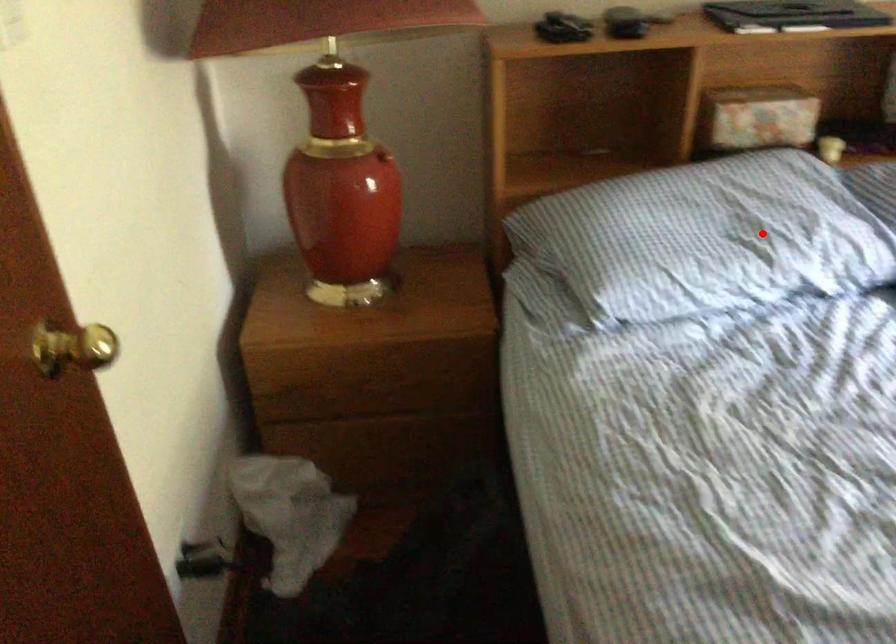
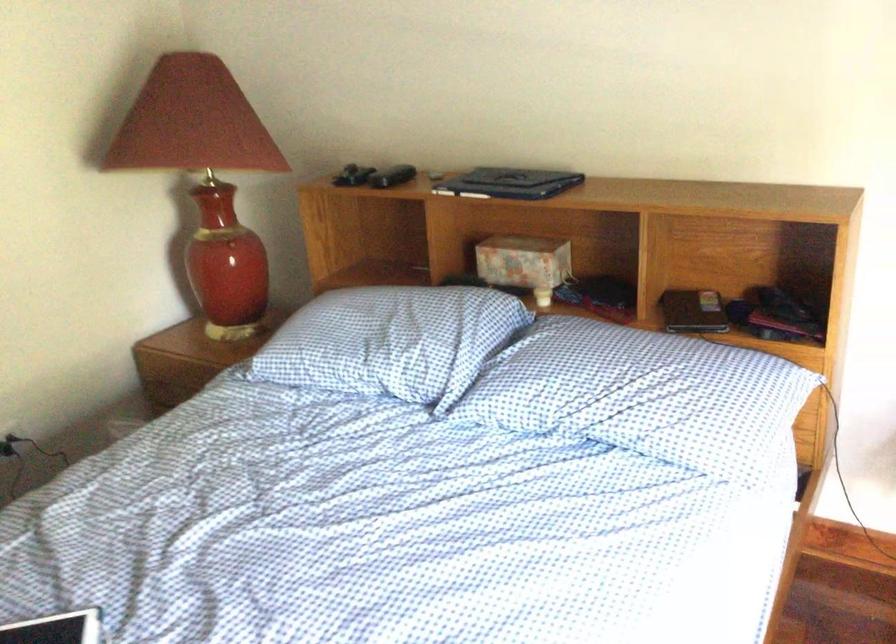
The point at the highlighted location is marked in the first image. Where is the corresponding point in the second image?

(384, 342)